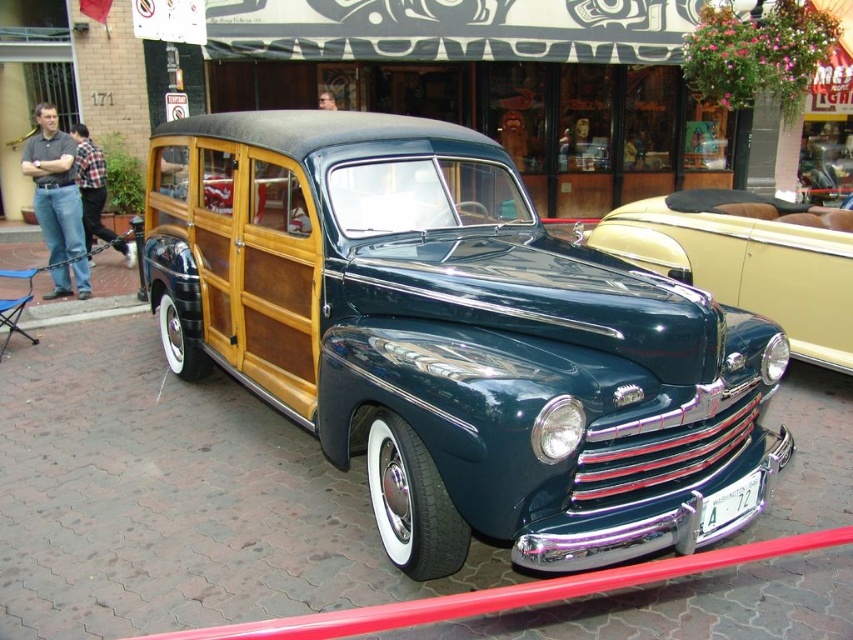
Question: Does shiny dark green wood paneling car at center lie in front of shiny dark green wood paneling at center?

Choices:
 (A) no
 (B) yes

Answer: (B)

Question: Which point is farther from the camera taking this photo?

Choices:
 (A) (782, 240)
 (B) (395, 275)

Answer: (A)

Question: Which of the following is the closest to the observer?

Choices:
 (A) shiny dark green wood paneling car at center
 (B) shiny dark green wood paneling at center

Answer: (A)

Question: Where is shiny dark green wood paneling car at center located in relation to shiny dark green wood paneling at center in the image?

Choices:
 (A) left
 (B) right

Answer: (A)

Question: Can you confirm if shiny dark green wood paneling car at center is positioned below shiny dark green wood paneling at center?

Choices:
 (A) yes
 (B) no

Answer: (A)